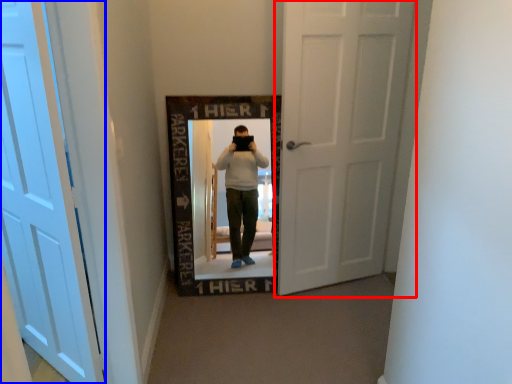
Question: Among these objects, which one is nearest to the camera, door (highlighted by a red box) or door (highlighted by a blue box)?

Choices:
 (A) door
 (B) door

Answer: (B)